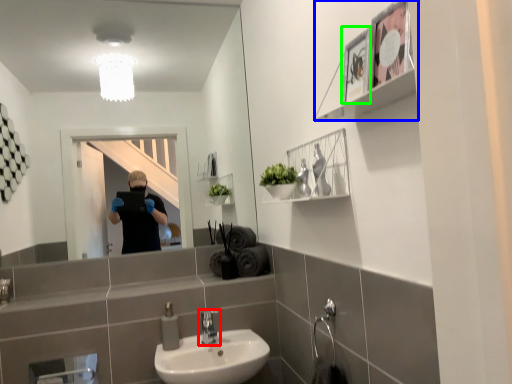
Question: Which object is positioned farthest from tap (highlighted by a red box)? Select from cabinet (highlighted by a blue box) and picture frame (highlighted by a green box).

Choices:
 (A) cabinet
 (B) picture frame

Answer: (A)